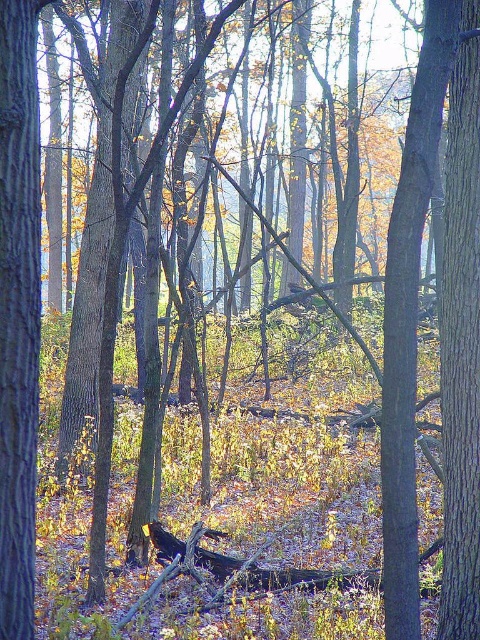
Is smooth brown tree trunk at left below dark brown wood log at center?

Incorrect, smooth brown tree trunk at left is not positioned below dark brown wood log at center.

Does smooth brown tree trunk at left have a greater height compared to dark brown wood log at center?

Yes.

Is point (34, 164) behind point (178, 544)?

No, (34, 164) is in front of (178, 544).

Where is `smooth brown tree trunk at left`? The width and height of the screenshot is (480, 640). smooth brown tree trunk at left is located at coordinates (19, 310).

Which is above, smooth brown tree trunk at center or smooth bark tree at right?

smooth bark tree at right is above.

Who is positioned more to the left, smooth brown tree trunk at center or smooth bark tree at right?

smooth brown tree trunk at center

Where is `smooth brown tree trunk at center`? This screenshot has width=480, height=640. smooth brown tree trunk at center is located at coordinates (408, 317).

Does smooth brown tree trunk at center appear on the left side of smooth brown tree trunk at left?

No, smooth brown tree trunk at center is not to the left of smooth brown tree trunk at left.

Between smooth brown tree trunk at center and smooth brown tree trunk at left, which one appears on the right side from the viewer's perspective?

From the viewer's perspective, smooth brown tree trunk at center appears more on the right side.

Which is in front, point (460, 16) or point (23, 93)?

Positioned in front is point (460, 16).

This screenshot has height=640, width=480. Find the location of `smooth brown tree trunk at center`. smooth brown tree trunk at center is located at coordinates (408, 317).